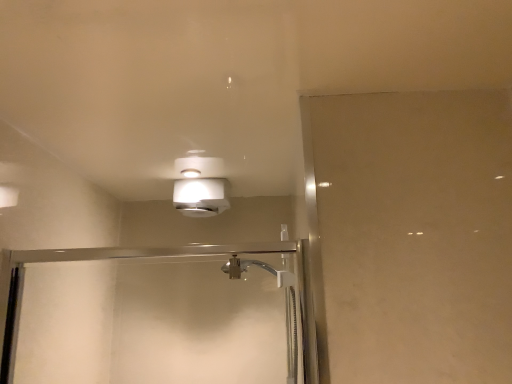
This screenshot has height=384, width=512. Describe the element at coordinates (200, 186) in the screenshot. I see `white glossy light fixture at upper center` at that location.

Locate an element on the screen. This screenshot has height=384, width=512. white glossy light fixture at upper center is located at coordinates (200, 186).

Locate an element on the screen. This screenshot has width=512, height=384. white glossy light fixture at upper center is located at coordinates (200, 186).